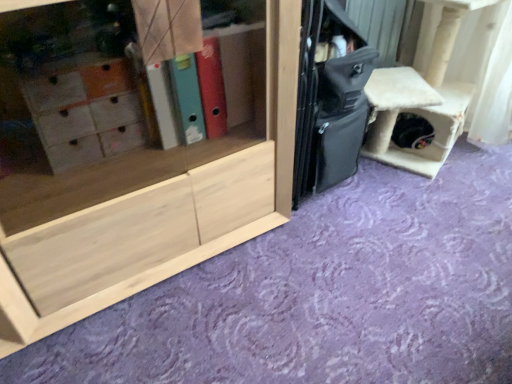
What do you see at coordinates (456, 82) in the screenshot?
I see `white fluffy cat house at right` at bounding box center [456, 82].

This screenshot has height=384, width=512. What are the coordinates of `white fluffy cat house at right` in the screenshot? It's located at (456, 82).

In the scene shown: Is the depth of black matte suitcase at center greater than that of natural wood cabinet at center?

Yes, black matte suitcase at center is further from the viewer.

Does point (306, 25) appear closer or farther from the camera than point (9, 301)?

Clearly, point (306, 25) is more distant from the camera than point (9, 301).

Between black matte suitcase at center and natural wood cabinet at center, which one has larger width?

natural wood cabinet at center.

From a real-world perspective, is black matte suitcase at center above or below natural wood cabinet at center?

black matte suitcase at center is below natural wood cabinet at center.

You are a GUI agent. You are given a task and a screenshot of the screen. Output one action in this format:
    pyautogui.click(x=<x>, y=<y>)
    Task: Click on the cabinetry to the left of white fluffy cat house at right
    
    Given the screenshot: What is the action you would take?
    pyautogui.click(x=152, y=201)

Is natural wood cabinet at center positioned with its back to white fluffy cat house at right?

That's not correct — natural wood cabinet at center is not looking away from white fluffy cat house at right.

Which is more to the left, natural wood cabinet at center or white fluffy cat house at right?

natural wood cabinet at center is more to the left.

How different are the orientations of natural wood cabinet at center and white fluffy cat house at right in degrees?

There is a 4.77-degree angle between the facing directions of natural wood cabinet at center and white fluffy cat house at right.

In terms of size, does white fluffy cat house at right appear bigger or smaller than black matte suitcase at center?

In the image, white fluffy cat house at right appears to be larger than black matte suitcase at center.

Is white fluffy cat house at right positioned beyond the bounds of black matte suitcase at center?

white fluffy cat house at right lies outside black matte suitcase at center's area.

In terms of height, does white fluffy cat house at right look taller or shorter compared to black matte suitcase at center?

white fluffy cat house at right is shorter than black matte suitcase at center.

How different are the orientations of white fluffy cat house at right and black matte suitcase at center in degrees?

white fluffy cat house at right and black matte suitcase at center are facing 5.05 degrees away from each other.

From the image's perspective, which one is positioned lower, white fluffy cat house at right or natural wood cabinet at center?

From the image's view, natural wood cabinet at center is below.

Between point (500, 19) and point (57, 122), which one is positioned in front?

The point (57, 122) is in front.

Is white fluffy cat house at right bigger or smaller than natural wood cabinet at center?

Clearly, white fluffy cat house at right is smaller in size than natural wood cabinet at center.

From a real-world perspective, is natural wood cabinet at center physically located above or below black matte suitcase at center?

natural wood cabinet at center is above black matte suitcase at center.

Is natural wood cabinet at center oriented towards black matte suitcase at center?

No, natural wood cabinet at center is not oriented towards black matte suitcase at center.

Is black matte suitcase at center surrounded by natural wood cabinet at center?

Actually, black matte suitcase at center is outside natural wood cabinet at center.

Between black matte suitcase at center and white fluffy cat house at right, which one has less height?

Standing shorter between the two is white fluffy cat house at right.

Based on the photo, is black matte suitcase at center positioned before white fluffy cat house at right?

Yes.

From a real-world perspective, is black matte suitcase at center located higher than white fluffy cat house at right?

Correct, in the physical world, black matte suitcase at center is higher than white fluffy cat house at right.

Where is `cabinetry that is on the left side of black matte suitcase at center`? Image resolution: width=512 pixels, height=384 pixels. cabinetry that is on the left side of black matte suitcase at center is located at coordinates pos(152,201).

This screenshot has height=384, width=512. Find the location of `cabinetry in front of the white fluffy cat house at right`. cabinetry in front of the white fluffy cat house at right is located at coordinates 152,201.

Looking at the image, which one is located closer to natural wood cabinet at center, black matte suitcase at center or white fluffy cat house at right?

Based on the image, black matte suitcase at center appears to be nearer to natural wood cabinet at center.

Based on their spatial positions, is natural wood cabinet at center or black matte suitcase at center closer to white fluffy cat house at right?

black matte suitcase at center.

Looking at the image, which one is located further to black matte suitcase at center, natural wood cabinet at center or white fluffy cat house at right?

Among the two, white fluffy cat house at right is located further to black matte suitcase at center.

When comparing their distances from white fluffy cat house at right, does black matte suitcase at center or natural wood cabinet at center seem closer?

Based on the image, black matte suitcase at center appears to be nearer to white fluffy cat house at right.

Considering their positions, is white fluffy cat house at right positioned closer to black matte suitcase at center than natural wood cabinet at center?

natural wood cabinet at center.

Looking at the image, which one is located closer to natural wood cabinet at center, white fluffy cat house at right or black matte suitcase at center?

Among the two, black matte suitcase at center is located nearer to natural wood cabinet at center.

Find the location of `luggage between natural wood cabinet at center and white fluffy cat house at right from left to right`. luggage between natural wood cabinet at center and white fluffy cat house at right from left to right is located at coordinates (329, 100).